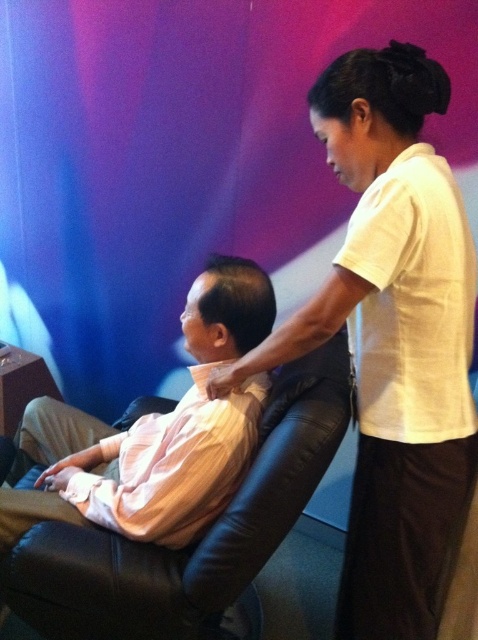
Based on the photo, you are a photographer setting up a shoot in the room described. You have a narrow shelf that can only hold items thinner than the black leather swivel chair at center. Can the white cotton shirt at upper right fit on the shelf?

The white cotton shirt at upper right is thinner than the black leather swivel chair at center, so it can fit on the shelf.

You are a photographer positioned at the camera. You want to take a closeup shot of the white cotton shirt at upper right. Can you get a clear closeup without moving the camera?

The white cotton shirt at upper right is 37.68 inches away from the camera. Since this distance is within the typical focusing range of most cameras, you can achieve a clear closeup shot without needing to move the camera.